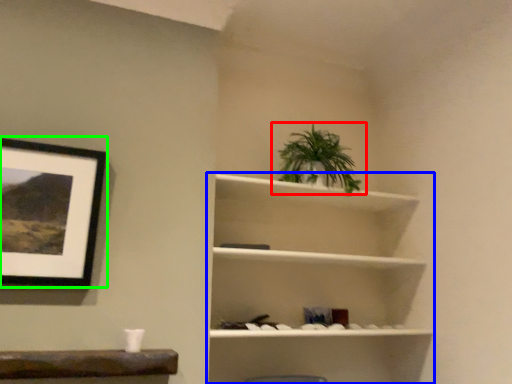
Question: Which object is positioned farthest from houseplant (highlighted by a red box)? Select from shelf (highlighted by a blue box) and picture frame (highlighted by a green box).

Choices:
 (A) shelf
 (B) picture frame

Answer: (B)